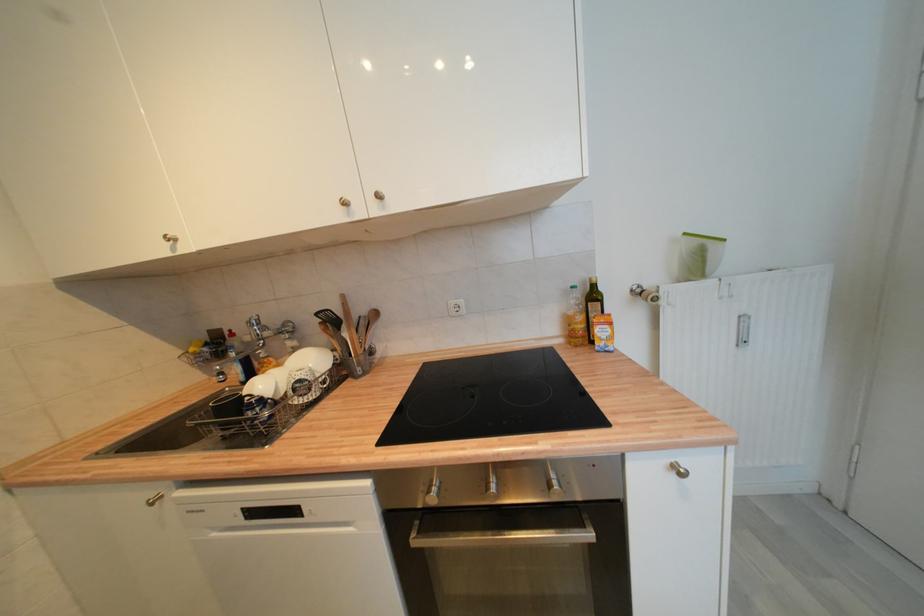
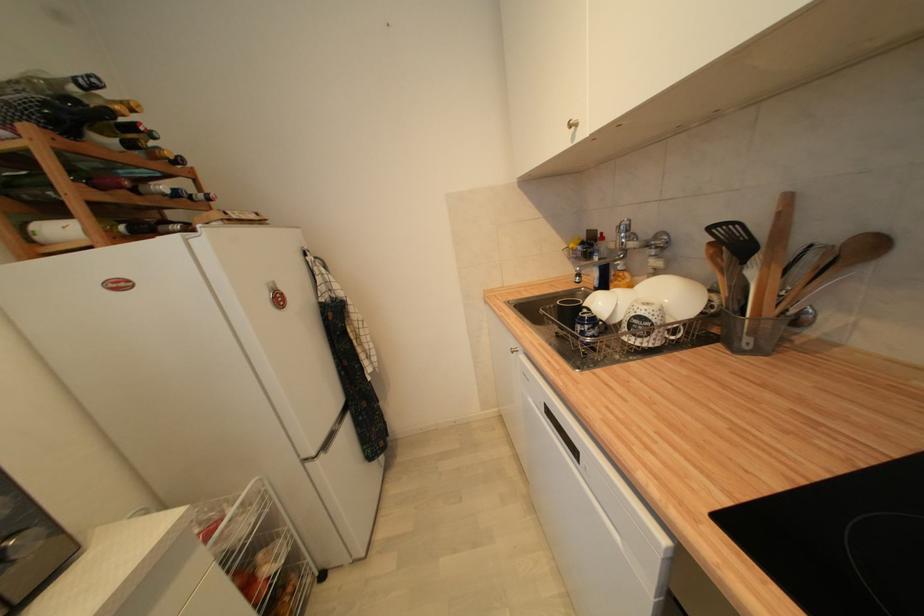
The point at (225, 331) is marked in the first image. Where is the corresponding point in the second image?

(602, 233)